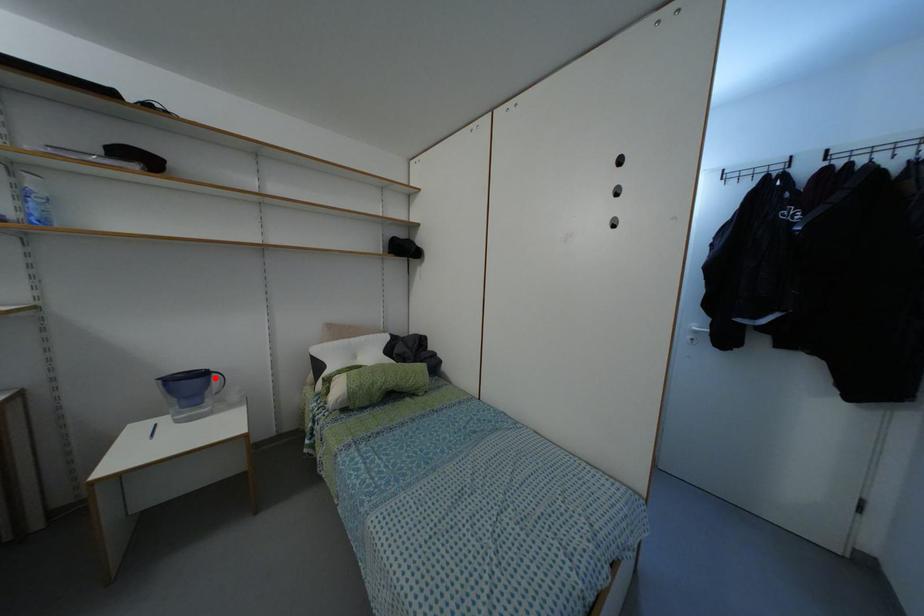
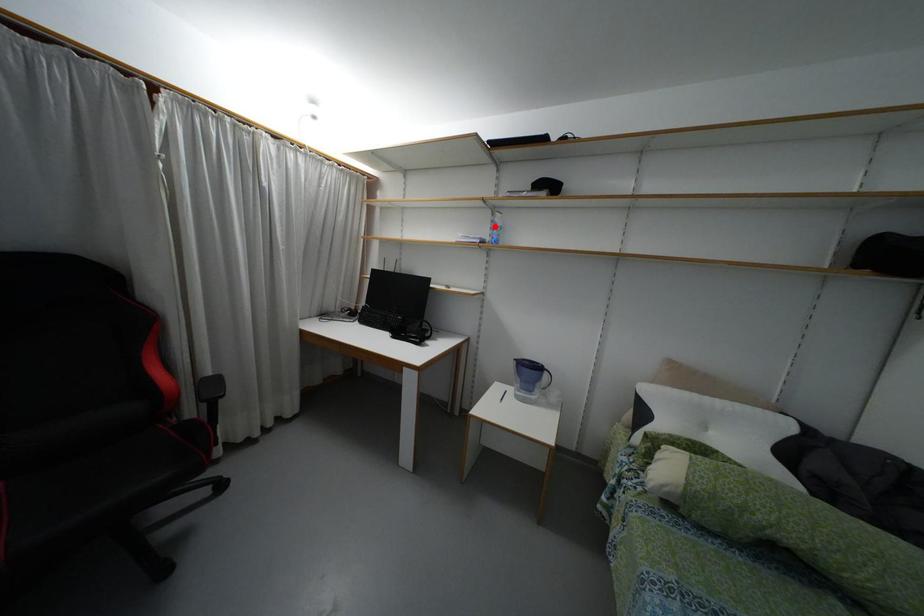
I am providing you with two images of the same scene from different viewpoints. A red point is marked on the first image and another point is marked on the second image. Is the marked point in image1 the same physical position as the marked point in image2?

No